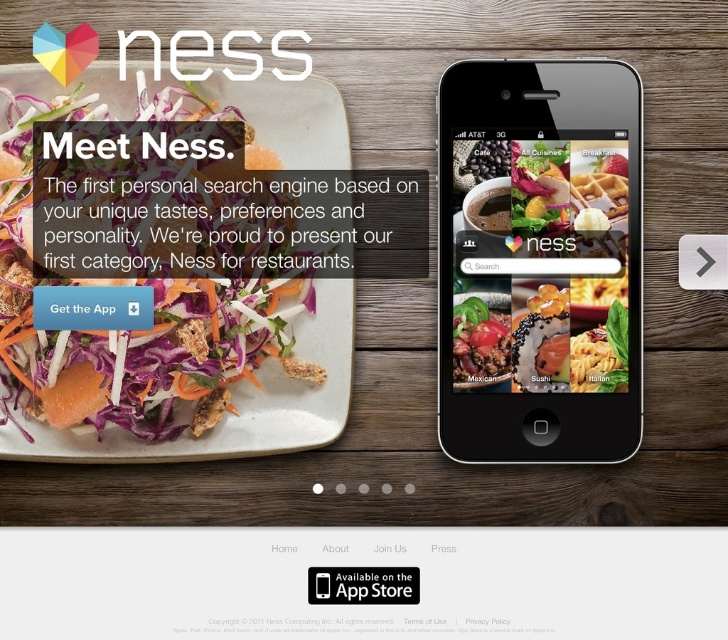
You are holding a black glossy smartphone at upper right. If you want to place it on the white plate with salad on the left side, will it fit without overlapping the salad?

The black glossy smartphone at upper right and viewer are 17.07 inches apart. However, the question is about placing the smartphone on the white plate with salad. The description does not provide information about the size of the smartphone or the plate, so we cannot determine if it will fit without overlapping the salad.

You are holding a smartphone with a 6.5 inch screen. You want to take a photo of the salad on the left side of the image. If you position your phone so that the camera is exactly at the point marked by the coordinates point (539, 404), will the entire salad fit within the camera frame?

The point (539, 404) is 17.79 inches away from the camera. Since the smartphone has a 6.5 inch screen, the distance from the camera to the point is greater than the screen size. Therefore, the entire salad will fit within the camera frame.